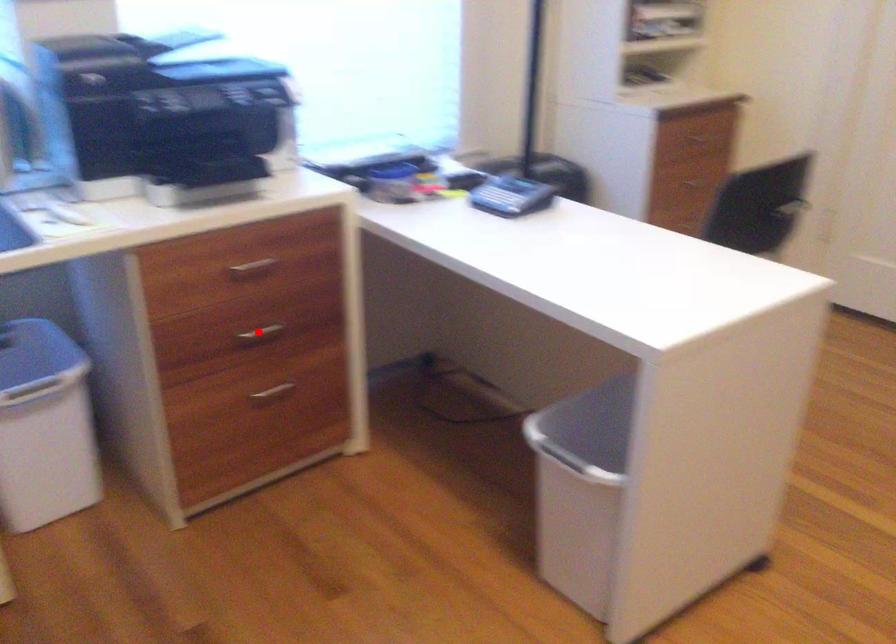
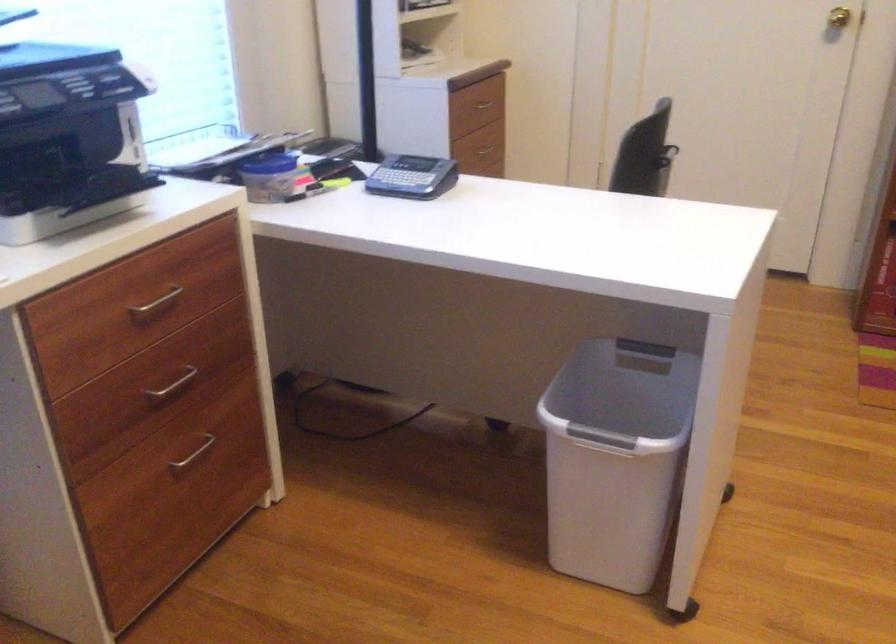
Question: I am providing you with two images of the same scene from different viewpoints. Given a red point in image1, look at the same physical point in image2. Is it:

Choices:
 (A) Closer to the viewpoint
 (B) Farther from the viewpoint

Answer: (A)